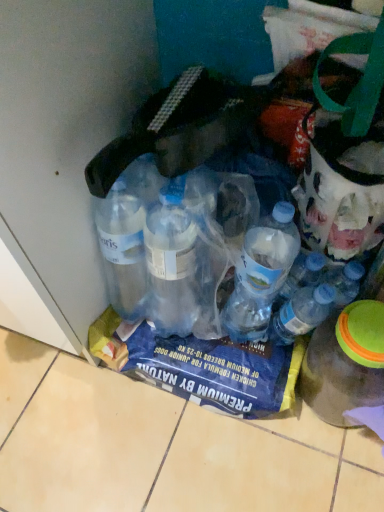
Question: From a real-world perspective, is transparent plastic bottles at lower left, the 1th bottle when ordered from left to right, physically located above or below transparent plastic bottle at lower right, which is the 1th bottle from right to left?

Choices:
 (A) below
 (B) above

Answer: (B)

Question: From the image's perspective, is transparent plastic bottles at lower left, the 1th bottle when ordered from left to right, located above or below transparent plastic bottle at lower right, arranged as the 3th bottle when viewed from the left?

Choices:
 (A) above
 (B) below

Answer: (A)

Question: Which is nearer to the transparent plastic bottles at lower left, the third bottle positioned from the right?

Choices:
 (A) translucent plastic bottle at center, placed as the 2th bottle when sorted from left to right
 (B) transparent plastic bottle at lower right, which is the 1th bottle from right to left

Answer: (A)

Question: Estimate the real-world distances between objects in this image. Which object is farther from the transparent plastic bottles at lower left, the third bottle positioned from the right?

Choices:
 (A) transparent plastic bottle at lower right, arranged as the 3th bottle when viewed from the left
 (B) translucent plastic bottle at center, which is counted as the second bottle, starting from the right

Answer: (A)